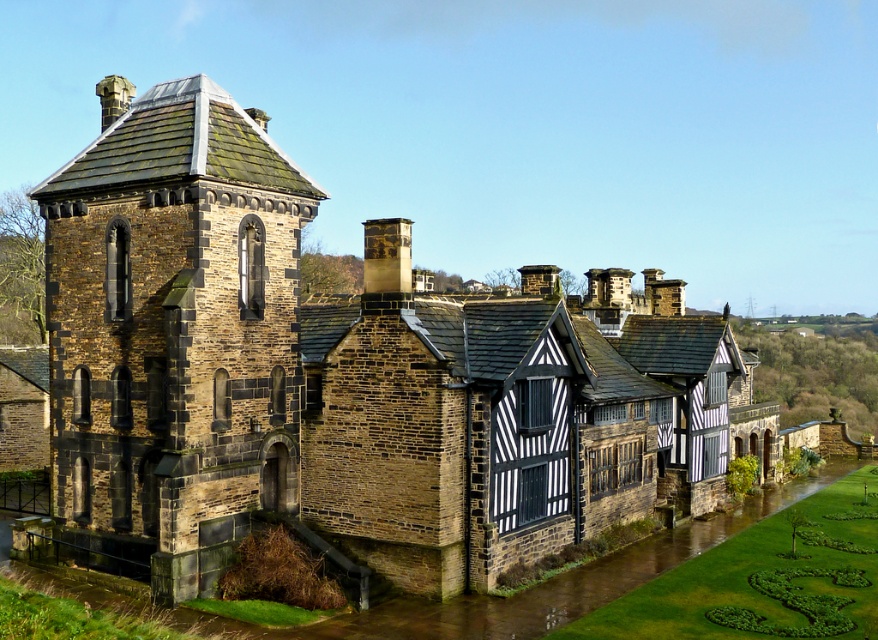
Question: Is brown stone tower at left above brown stone flood at lower left?

Choices:
 (A) no
 (B) yes

Answer: (B)

Question: Which point is closer to the camera?

Choices:
 (A) (236, 444)
 (B) (371, 243)

Answer: (A)

Question: Which object appears closest to the camera in this image?

Choices:
 (A) brown stone flood at lower left
 (B) brown stone tower at left

Answer: (A)

Question: Which object is positioned closest to the brown stone tower at left?

Choices:
 (A) dark brown stone chimney at center
 (B) brown stone flood at lower left

Answer: (A)

Question: Can you confirm if brown stone tower at left is wider than brown stone flood at lower left?

Choices:
 (A) yes
 (B) no

Answer: (B)

Question: Can you confirm if brown stone tower at left is positioned below brown stone flood at lower left?

Choices:
 (A) yes
 (B) no

Answer: (B)